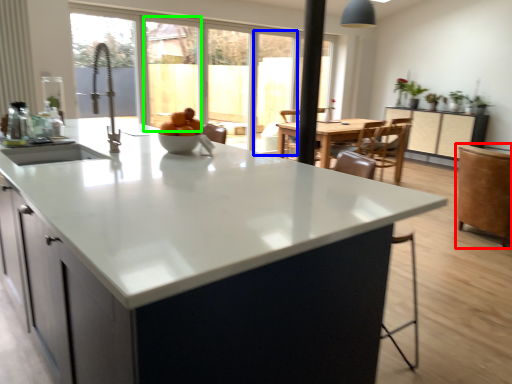
Question: Which is farther away from swivel chair (highlighted by a red box)? screen door (highlighted by a blue box) or window screen (highlighted by a green box)?

Choices:
 (A) screen door
 (B) window screen

Answer: (B)